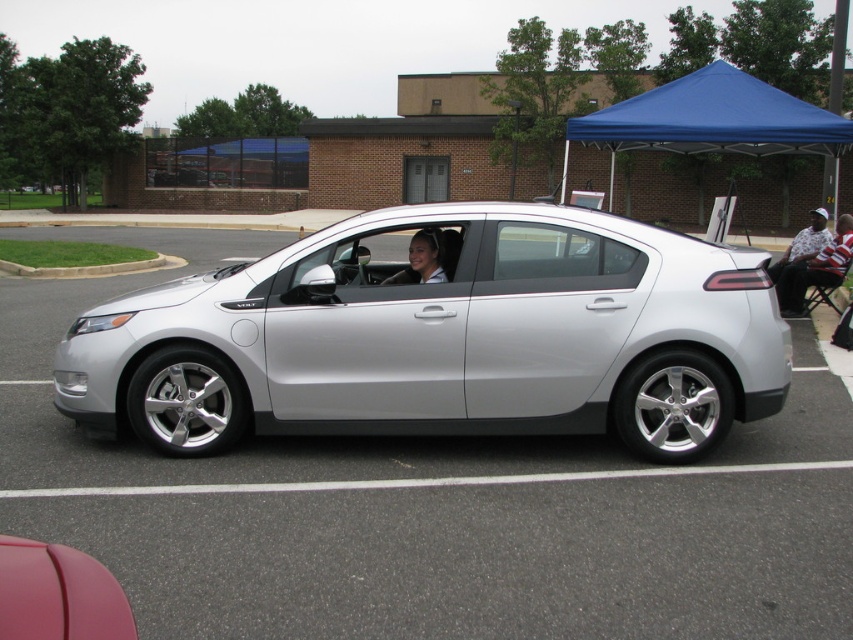
Question: Which object is positioned farthest from the silver metallic car at center?

Choices:
 (A) blue fabric canopy at upper right
 (B) matte black hair at center

Answer: (A)

Question: Which of the following is the closest to the observer?

Choices:
 (A) metallic pink car at lower left
 (B) silver metallic sedan at center

Answer: (A)

Question: Does metallic pink car at lower left have a larger size compared to matte black hair at center?

Choices:
 (A) yes
 (B) no

Answer: (B)

Question: Does metallic pink car at lower left have a greater width compared to white shirt at right?

Choices:
 (A) no
 (B) yes

Answer: (A)

Question: In this image, where is blue fabric canopy at upper right located relative to metallic pink car at lower left?

Choices:
 (A) below
 (B) above

Answer: (B)

Question: Considering the real-world distances, which object is closest to the matte black hair at center?

Choices:
 (A) silver metallic car at center
 (B) silver metallic sedan at center
 (C) blue fabric canopy at upper right

Answer: (B)